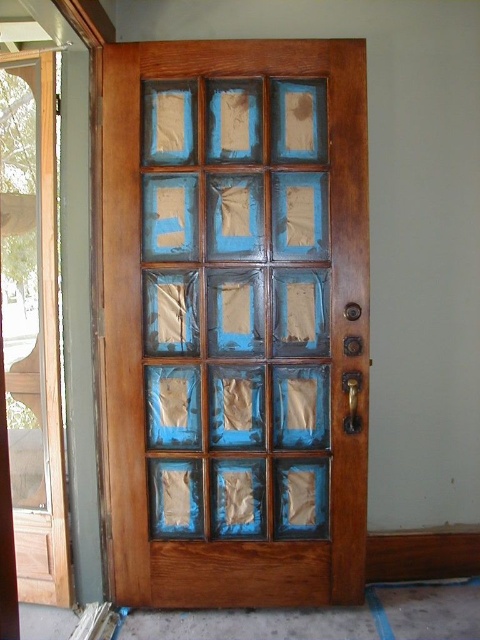
Describe the element at coordinates (236, 321) in the screenshot. I see `wooden door at center` at that location.

Between point (236, 401) and point (12, 420), which one is positioned behind?

Positioned behind is point (12, 420).

Is point (263, 68) in front of point (37, 276)?

Yes, point (263, 68) is in front of point (37, 276).

You are a GUI agent. You are given a task and a screenshot of the screen. Output one action in this format:
    pyautogui.click(x=<x>, y=<y>)
    Task: Click on the wooden door at center
    
    Given the screenshot: What is the action you would take?
    pyautogui.click(x=236, y=321)